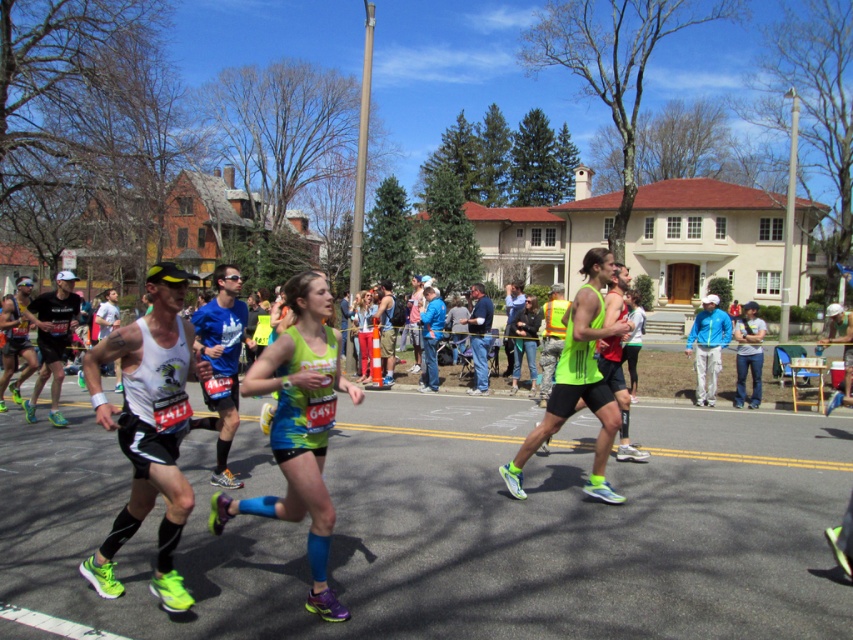
Looking at this image, you are a photographer at the marathon event and want to capture a photo of the neon green fabric at center. Where should you aim your camera to ensure the fabric is centered in the photo?

You should aim your camera at the coordinates point (299, 428) to center the neon green fabric at center in the photo.

You are a photographer standing at the starting line of the marathon. You want to take a photo that includes both the point at [299,426] and the point at [364,324]. Which point should you focus on first to ensure both are in focus?

You should focus on the point at [364,324] first because it is farther from the camera compared to the point at [299,426]. By focusing on the farther point, the closer point will also be within the depth of field, ensuring both are in focus.